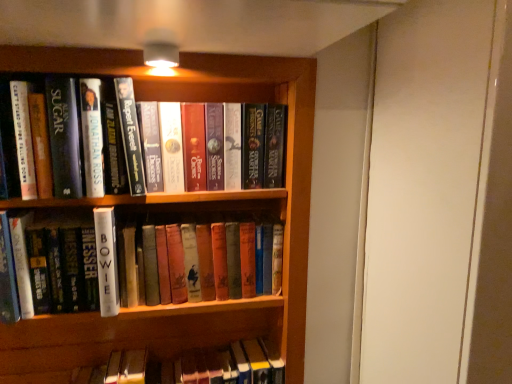
Question: Is hardcover books at center, positioned as the 3th book in bottom-to-top order, in front of or behind hardcover book at upper left, the second book when ordered from top to bottom, in the image?

Choices:
 (A) behind
 (B) front

Answer: (A)

Question: In terms of width, does hardcover books at center, positioned as the 3th book in bottom-to-top order, look wider or thinner when compared to hardcover book at upper left, the second book when ordered from top to bottom?

Choices:
 (A) thin
 (B) wide

Answer: (A)

Question: Which object is positioned closest to the white matte book at center, which ranks as the 3th book in top-to-bottom order?

Choices:
 (A) hardcover book at upper left, the second book when ordered from top to bottom
 (B) hardcover books at center, positioned as the 3th book in bottom-to-top order
 (C) wooden bookcase at center

Answer: (A)

Question: Which object is the closest to the hardcover book at upper left, the second book when ordered from top to bottom?

Choices:
 (A) hardcover books at center, positioned as the 3th book in bottom-to-top order
 (B) wooden bookcase at center
 (C) white matte book at center, which ranks as the 3th book in top-to-bottom order

Answer: (A)